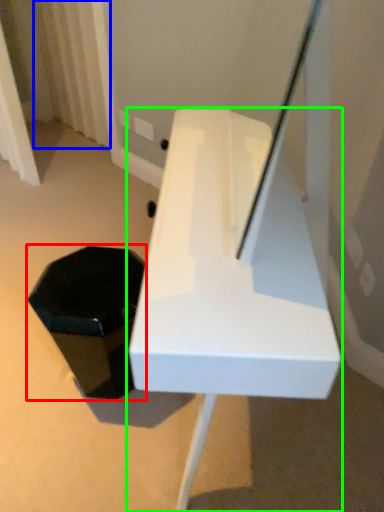
Question: Which object is the closest to the storage box (highlighted by a red box)? Choose among these: curtain (highlighted by a blue box) or furniture (highlighted by a green box).

Choices:
 (A) curtain
 (B) furniture

Answer: (B)